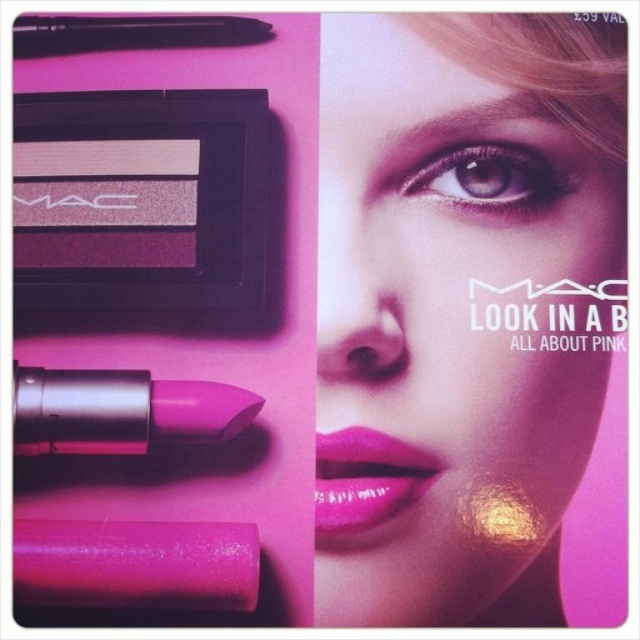
Does matte pink eye at upper center appear on the left side of matte pink lipstick at center?

In fact, matte pink eye at upper center is to the right of matte pink lipstick at center.

Is matte pink eye at upper center positioned behind matte pink lipstick at center?

Yes, matte pink eye at upper center is further from the viewer.

Where is `matte pink eye at upper center`? matte pink eye at upper center is located at coordinates (486, 180).

Can you confirm if shiny pink lipstick at center is smaller than matte black pen at lower left?

No.

Is point (253, 552) less distant than point (257, 396)?

Yes, it is.

Where is `shiny pink lipstick at center`? The width and height of the screenshot is (640, 640). shiny pink lipstick at center is located at coordinates (134, 563).

Who is shorter, matte pink lipstick at lower left or shiny pink lipstick at center?

Standing shorter between the two is shiny pink lipstick at center.

From the picture: Who is more forward, (333, 33) or (138, 572)?

Positioned in front is point (138, 572).

Find the location of a particular element. matte pink lipstick at lower left is located at coordinates (461, 307).